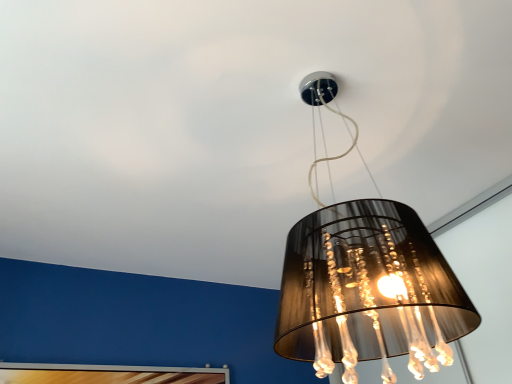
What is the approximate width of smokey glass chandelier at center?

The width of smokey glass chandelier at center is 16.24 inches.

Find the location of a particular element. This screenshot has height=384, width=512. smokey glass chandelier at center is located at coordinates (368, 292).

What do you see at coordinates (368, 292) in the screenshot?
I see `smokey glass chandelier at center` at bounding box center [368, 292].

From the picture: Measure the distance between smokey glass chandelier at center and camera.

smokey glass chandelier at center is 27.59 inches from camera.

Measure the distance between point (371, 328) and camera.

Point (371, 328) and camera are 3.47 feet apart from each other.

This screenshot has height=384, width=512. I want to click on smokey glass chandelier at center, so click(x=368, y=292).